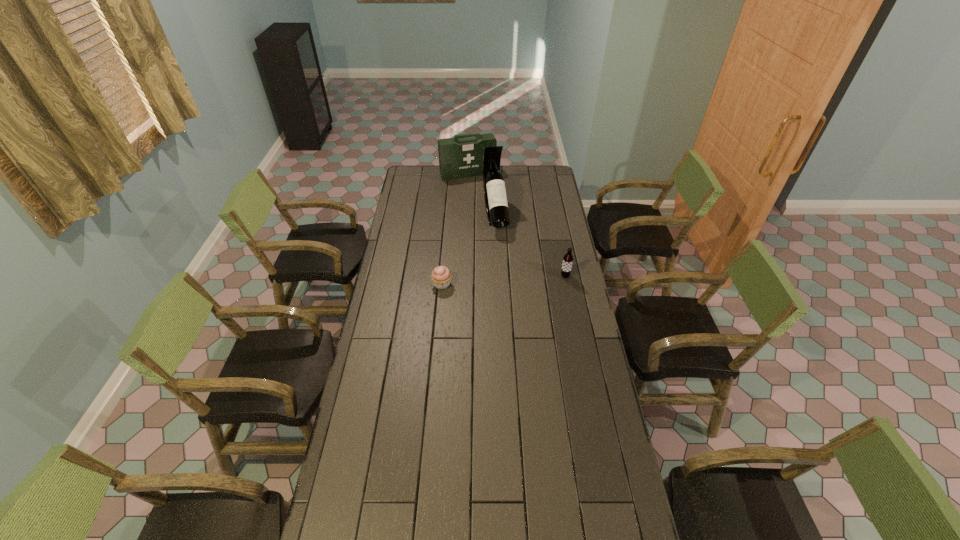
The image size is (960, 540). In order to click on free space between the root beer and the cupcake in this screenshot , I will do `click(504, 280)`.

The height and width of the screenshot is (540, 960). I want to click on free spot between the first-aid kit and the cupcake, so click(455, 229).

I want to click on the second closest object relative to the root beer, so click(441, 276).

The height and width of the screenshot is (540, 960). In order to click on object that can be found as the third closest to the second tallest object in this screenshot , I will do `click(567, 263)`.

The height and width of the screenshot is (540, 960). Identify the location of vacant space that satisfies the following two spatial constraints: 1. on the front side of the third nearest object; 2. on the right side of the rightmost object. (498, 276).